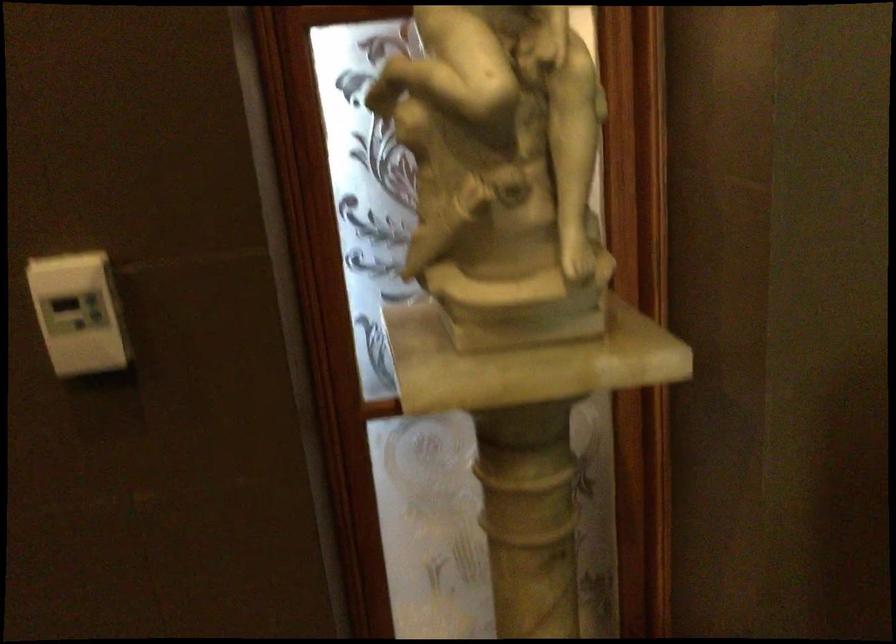
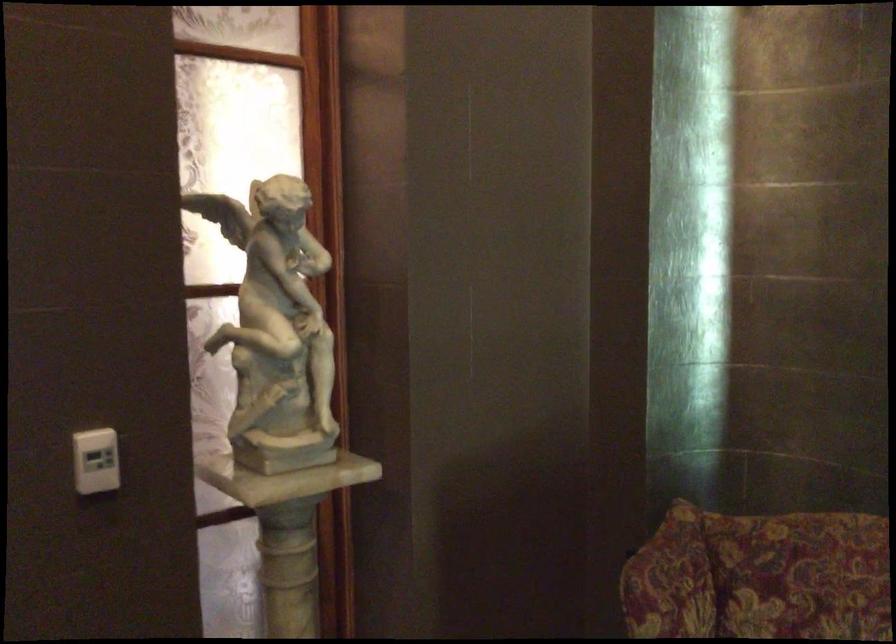
In the second image, find the point that corresponds to [96,313] in the first image.

(95, 460)